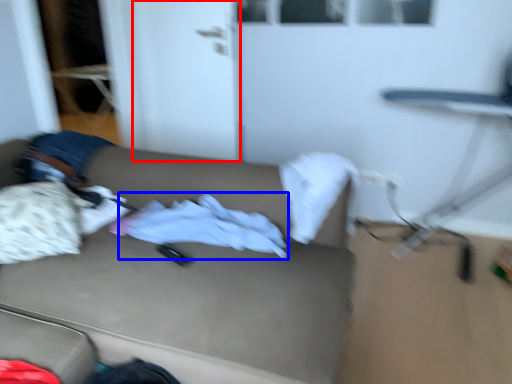
Question: Which point is closer to the camera, door (highlighted by a red box) or baby clothe (highlighted by a blue box)?

Choices:
 (A) door
 (B) baby clothe

Answer: (B)